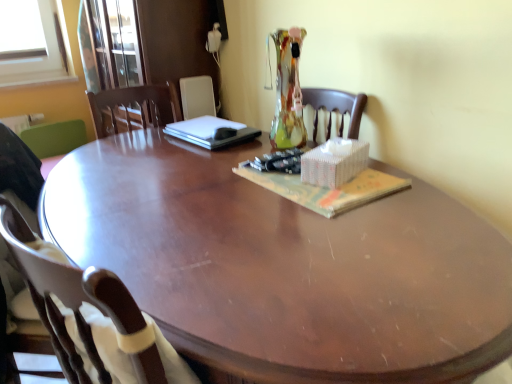
Describe the element at coordinates (49, 292) in the screenshot. I see `brown wood chair at lower left, marked as the 3th chair in a back-to-front arrangement` at that location.

What do you see at coordinates (285, 267) in the screenshot?
I see `glossy wood desk at center` at bounding box center [285, 267].

Describe the element at coordinates (92, 318) in the screenshot. I see `brown wood chair at lower left, the second chair in the back-to-front sequence` at that location.

Locate an element on the screen. green fabric chair at left, the 1th chair from the back is located at coordinates (54, 141).

What is the approximate width of green fabric chair at left, the 1th chair from the back?

green fabric chair at left, the 1th chair from the back, is 37.62 centimeters wide.

This screenshot has height=384, width=512. I want to click on brown wood chair at lower left, the first chair in the front-to-back sequence, so click(49, 292).

From a real-world perspective, does green fabric chair at left, the 1th chair from the back, stand above matte paper magazine at center?

No.

Consider the image. Considering the sizes of objects green fabric chair at left, the 1th chair from the back, and matte paper magazine at center in the image provided, who is bigger, green fabric chair at left, the 1th chair from the back, or matte paper magazine at center?

With larger size is green fabric chair at left, the 1th chair from the back.

Is matte paper magazine at center at the back of green fabric chair at left, the 1th chair from the back?

green fabric chair at left, the 1th chair from the back, does not have its back to matte paper magazine at center.

Is green fabric chair at left, the 3th chair viewed from the front, further to camera compared to matte paper magazine at center?

Yes, green fabric chair at left, the 3th chair viewed from the front, is behind matte paper magazine at center.

From a real-world perspective, which object stands above the other?

In real-world perspective, sleek black laptop at center is above.

Considering the sizes of objects sleek black laptop at center and matte paper magazine at center in the image provided, who is wider, sleek black laptop at center or matte paper magazine at center?

Wider between the two is matte paper magazine at center.

Is sleek black laptop at center positioned in front of matte paper magazine at center?

That is False.

Can you confirm if sleek black laptop at center is smaller than matte paper magazine at center?

No, sleek black laptop at center is not smaller than matte paper magazine at center.

Does green fabric chair at left, the 3th chair viewed from the front, have a larger size compared to sleek black laptop at center?

Correct, green fabric chair at left, the 3th chair viewed from the front, is larger in size than sleek black laptop at center.

From the image's perspective, which one is positioned lower, green fabric chair at left, the 1th chair from the back, or sleek black laptop at center?

green fabric chair at left, the 1th chair from the back.

From a real-world perspective, is green fabric chair at left, the 1th chair from the back, positioned above or below sleek black laptop at center?

From a real-world perspective, green fabric chair at left, the 1th chair from the back, is physically below sleek black laptop at center.

Which is behind, point (24, 140) or point (199, 130)?

The point (24, 140) is farther.

Is glossy wood desk at center positioned behind brown wood chair at lower left, the first chair in the front-to-back sequence?

No, it is in front of brown wood chair at lower left, the first chair in the front-to-back sequence.

Is glossy wood desk at center taller than brown wood chair at lower left, marked as the 3th chair in a back-to-front arrangement?

Incorrect, the height of glossy wood desk at center is not larger of that of brown wood chair at lower left, marked as the 3th chair in a back-to-front arrangement.

Is brown wood chair at lower left, the first chair in the front-to-back sequence, completely or partially inside glossy wood desk at center?

That's incorrect, brown wood chair at lower left, the first chair in the front-to-back sequence, is not inside glossy wood desk at center.

Can you tell me how much glossy wood desk at center and brown wood chair at lower left, marked as the 3th chair in a back-to-front arrangement, differ in facing direction?

glossy wood desk at center and brown wood chair at lower left, marked as the 3th chair in a back-to-front arrangement, are facing 34.1 degrees away from each other.

Can we say brown wood chair at lower left, positioned as the second chair in front-to-back order, lies outside matte paper magazine at center?

brown wood chair at lower left, positioned as the second chair in front-to-back order, lies outside matte paper magazine at center's area.

In the image, is brown wood chair at lower left, positioned as the second chair in front-to-back order, positioned in front of or behind matte paper magazine at center?

In the image, brown wood chair at lower left, positioned as the second chair in front-to-back order, appears in front of matte paper magazine at center.

Which object is positioned more to the right, brown wood chair at lower left, the second chair in the back-to-front sequence, or matte paper magazine at center?

Positioned to the right is matte paper magazine at center.

Is matte paper magazine at center far from brown wood chair at lower left, the second chair in the back-to-front sequence?

No, matte paper magazine at center is not far from brown wood chair at lower left, the second chair in the back-to-front sequence.

Does matte paper magazine at center turn towards brown wood chair at lower left, the second chair in the back-to-front sequence?

Yes, matte paper magazine at center is facing brown wood chair at lower left, the second chair in the back-to-front sequence.

Identify the location of chair that is the 1st object to the left of the matte paper magazine at center, starting at the anchor. This screenshot has height=384, width=512. (92, 318).

Consider the image. Can we say matte paper magazine at center lies outside brown wood chair at lower left, positioned as the second chair in front-to-back order?

Yes, matte paper magazine at center is not within brown wood chair at lower left, positioned as the second chair in front-to-back order.

Is glossy wood desk at center turned away from sleek black laptop at center?

No.

In the scene shown: Would you say glossy wood desk at center contains sleek black laptop at center?

That's incorrect, sleek black laptop at center is not inside glossy wood desk at center.

Between glossy wood desk at center and sleek black laptop at center, which one has smaller width?

With smaller width is sleek black laptop at center.

Locate an element on the screen. The width and height of the screenshot is (512, 384). chair lying behind the matte paper magazine at center is located at coordinates (54, 141).

This screenshot has height=384, width=512. I want to click on magazine located below the sleek black laptop at center (from the image's perspective), so click(326, 189).

Looking at the image, which one is located closer to brown wood chair at lower left, the first chair in the front-to-back sequence, matte paper magazine at center or glossy wood desk at center?

glossy wood desk at center lies closer to brown wood chair at lower left, the first chair in the front-to-back sequence, than the other object.

Estimate the real-world distances between objects in this image. Which object is closer to matte paper magazine at center, brown wood chair at lower left, marked as the 3th chair in a back-to-front arrangement, or sleek black laptop at center?

Based on the image, sleek black laptop at center appears to be nearer to matte paper magazine at center.

Estimate the real-world distances between objects in this image. Which object is further from green fabric chair at left, the 3th chair viewed from the front, sleek black laptop at center or matte paper magazine at center?

matte paper magazine at center lies further to green fabric chair at left, the 3th chair viewed from the front, than the other object.

Considering their positions, is glossy wood desk at center positioned closer to brown wood chair at lower left, the second chair in the back-to-front sequence, than green fabric chair at left, the 1th chair from the back?

Based on the image, glossy wood desk at center appears to be nearer to brown wood chair at lower left, the second chair in the back-to-front sequence.

From the image, which object appears to be nearer to glossy wood desk at center, green fabric chair at left, the 3th chair viewed from the front, or brown wood chair at lower left, the first chair in the front-to-back sequence?

Based on the image, brown wood chair at lower left, the first chair in the front-to-back sequence, appears to be nearer to glossy wood desk at center.

Which object lies nearer to the anchor point sleek black laptop at center, matte paper magazine at center or brown wood chair at lower left, positioned as the second chair in front-to-back order?

matte paper magazine at center.

Estimate the real-world distances between objects in this image. Which object is further from brown wood chair at lower left, positioned as the second chair in front-to-back order, green fabric chair at left, the 3th chair viewed from the front, or glossy wood desk at center?

green fabric chair at left, the 3th chair viewed from the front.

Based on their spatial positions, is brown wood chair at lower left, marked as the 3th chair in a back-to-front arrangement, or brown wood chair at lower left, positioned as the second chair in front-to-back order, further from matte paper magazine at center?

The object further to matte paper magazine at center is brown wood chair at lower left, marked as the 3th chair in a back-to-front arrangement.

The height and width of the screenshot is (384, 512). I want to click on chair between brown wood chair at lower left, marked as the 3th chair in a back-to-front arrangement, and glossy wood desk at center, in the horizontal direction, so click(x=92, y=318).

Where is `chair between brown wood chair at lower left, marked as the 3th chair in a back-to-front arrangement, and green fabric chair at left, the 1th chair from the back, from front to back`? The image size is (512, 384). chair between brown wood chair at lower left, marked as the 3th chair in a back-to-front arrangement, and green fabric chair at left, the 1th chair from the back, from front to back is located at coordinates (92, 318).

Where is `desk between brown wood chair at lower left, positioned as the second chair in front-to-back order, and matte paper magazine at center`? Image resolution: width=512 pixels, height=384 pixels. desk between brown wood chair at lower left, positioned as the second chair in front-to-back order, and matte paper magazine at center is located at coordinates (285, 267).

Locate an element on the screen. chair between brown wood chair at lower left, marked as the 3th chair in a back-to-front arrangement, and matte paper magazine at center, in the horizontal direction is located at coordinates (92, 318).